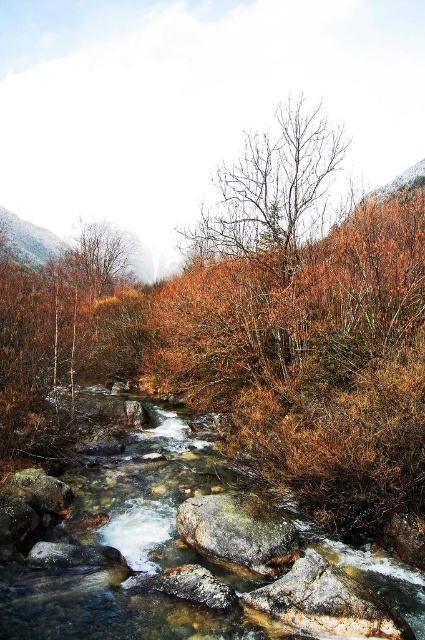
Question: Which point is farther to the camera?

Choices:
 (A) (110, 257)
 (B) (229, 540)
 (C) (56, 589)
 (D) (136, 586)

Answer: (A)

Question: Which point appears farthest from the camera in this image?

Choices:
 (A) (192, 595)
 (B) (169, 528)

Answer: (B)

Question: Which of the following is the closest to the observer?

Choices:
 (A) brown matte tree at upper left
 (B) clear water at center

Answer: (B)

Question: Can you confirm if rusty metallic rock at center is positioned above smooth gray rock at center?

Choices:
 (A) yes
 (B) no

Answer: (A)

Question: Is clear water at center below rusty metallic rock at center?

Choices:
 (A) yes
 (B) no

Answer: (B)

Question: Is brown matte tree at upper left to the right of smooth gray rock at center from the viewer's perspective?

Choices:
 (A) yes
 (B) no

Answer: (B)